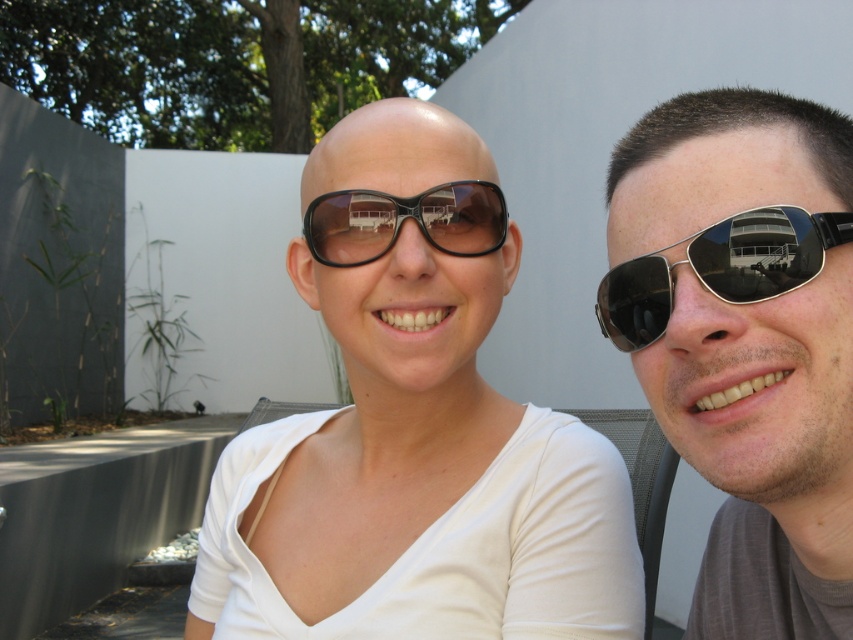
Between metallic aviator sunglasses at right and sunglasses at right, which one is positioned lower?

metallic aviator sunglasses at right is lower down.

Looking at this image, which of these two, metallic aviator sunglasses at right or sunglasses at right, stands shorter?

Standing shorter between the two is sunglasses at right.

The height and width of the screenshot is (640, 853). What do you see at coordinates (746, 340) in the screenshot? I see `metallic aviator sunglasses at right` at bounding box center [746, 340].

Where is `metallic aviator sunglasses at right`? metallic aviator sunglasses at right is located at coordinates (746, 340).

Between metallic aviator sunglasses at right and black matte sunglasses at center, which one is positioned lower?

metallic aviator sunglasses at right is lower down.

Can you confirm if metallic aviator sunglasses at right is shorter than black matte sunglasses at center?

No, metallic aviator sunglasses at right is not shorter than black matte sunglasses at center.

Which is in front, point (776, 474) or point (469, 195)?

Point (776, 474)

Where is `metallic aviator sunglasses at right`? The height and width of the screenshot is (640, 853). metallic aviator sunglasses at right is located at coordinates (746, 340).

Does point (405, 572) come closer to viewer compared to point (422, 193)?

Yes, point (405, 572) is in front of point (422, 193).

Is matte black sunglasses at center wider than black matte sunglasses at center?

Yes, matte black sunglasses at center is wider than black matte sunglasses at center.

What do you see at coordinates (415, 428) in the screenshot?
I see `matte black sunglasses at center` at bounding box center [415, 428].

The height and width of the screenshot is (640, 853). What are the coordinates of `matte black sunglasses at center` in the screenshot? It's located at (415, 428).